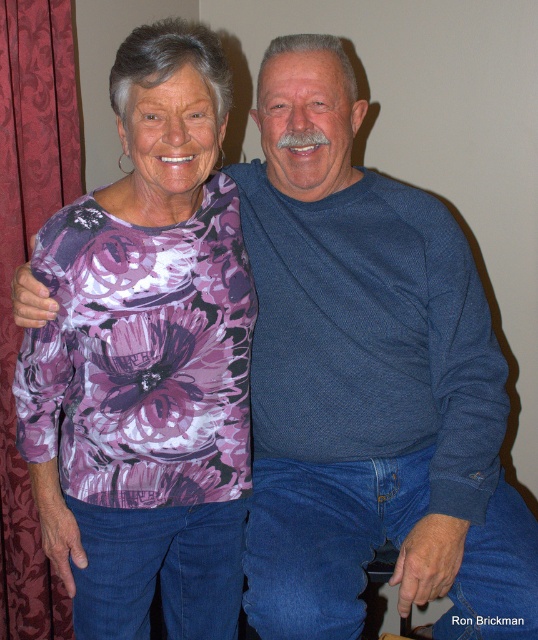
Question: Among these points, which one is nearest to the camera?

Choices:
 (A) (2, 256)
 (B) (194, 497)

Answer: (B)

Question: Which object appears farthest from the camera in this image?

Choices:
 (A) red velvet curtain at left
 (B) floral print shirt at center

Answer: (A)

Question: Can you confirm if floral print shirt at center is positioned to the left of red velvet curtain at left?

Choices:
 (A) no
 (B) yes

Answer: (A)

Question: Which point appears farthest from the camera in this image?

Choices:
 (A) (17, 93)
 (B) (111, 433)

Answer: (A)

Question: Is floral print shirt at center smaller than red velvet curtain at left?

Choices:
 (A) yes
 (B) no

Answer: (B)

Question: Is floral print shirt at center closer to camera compared to red velvet curtain at left?

Choices:
 (A) no
 (B) yes

Answer: (B)